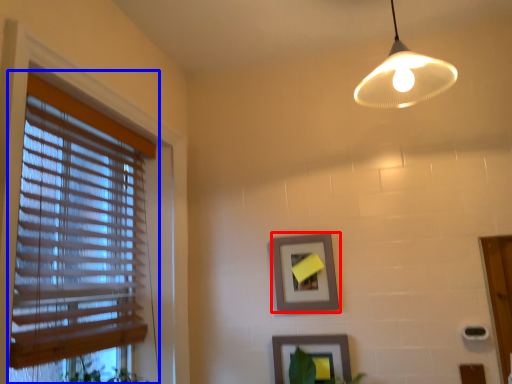
Question: Which point is further to the camera, picture frame (highlighted by a red box) or window blind (highlighted by a blue box)?

Choices:
 (A) picture frame
 (B) window blind

Answer: (A)